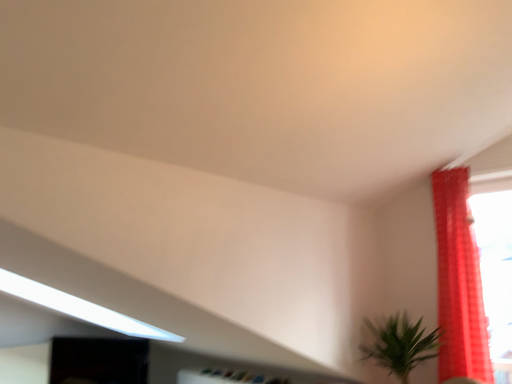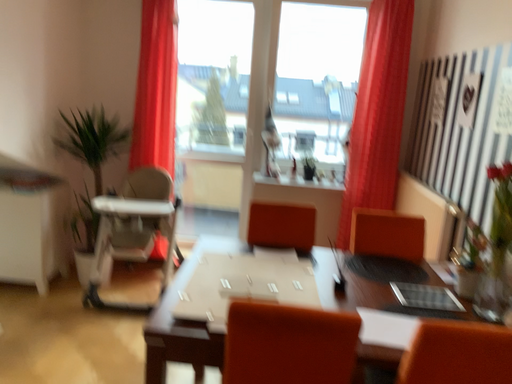
Question: How did the camera likely rotate when shooting the video?

Choices:
 (A) rotated downward
 (B) rotated upward

Answer: (A)